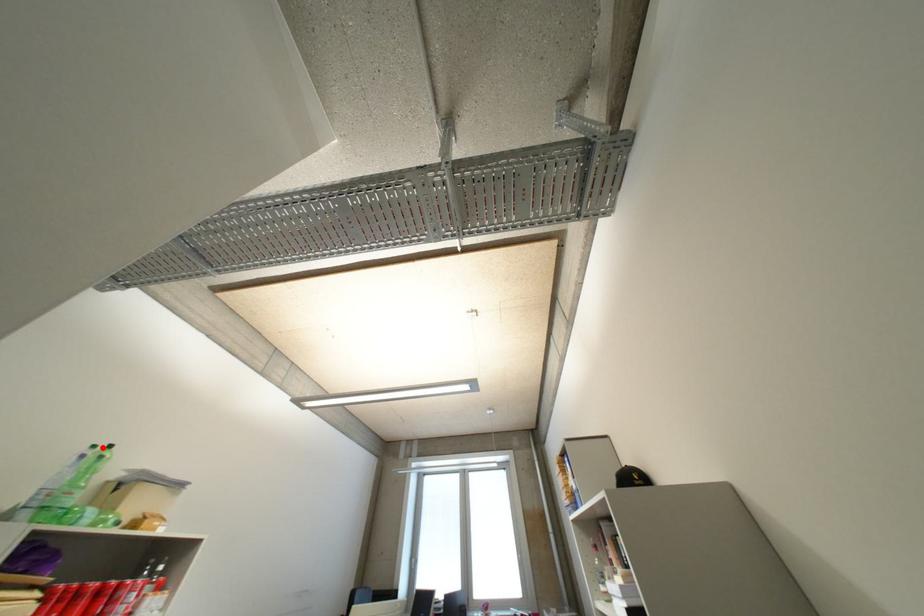
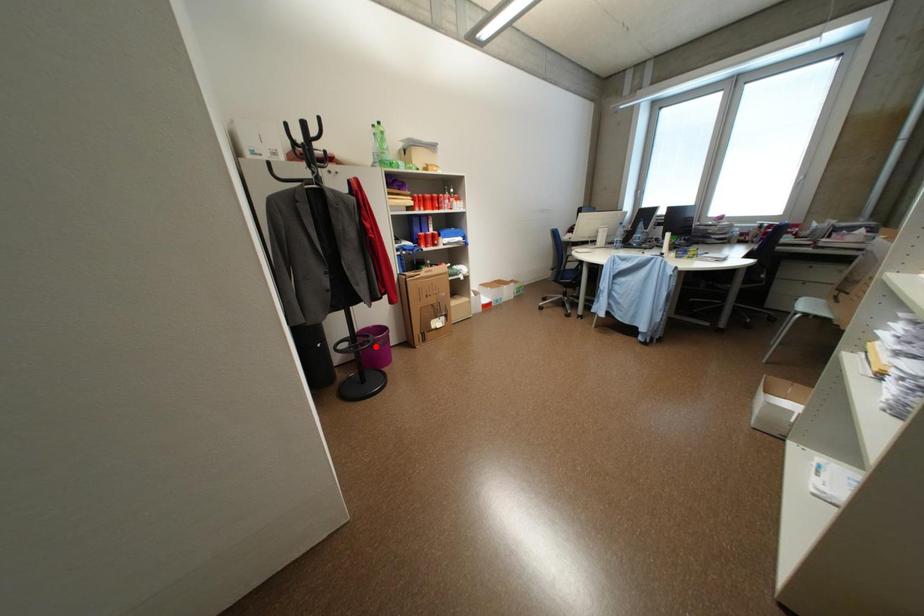
I am providing you with two images of the same scene from different viewpoints. A red point is marked on the first image and another point is marked on the second image. Is the marked point in image1 the same physical position as the marked point in image2?

No